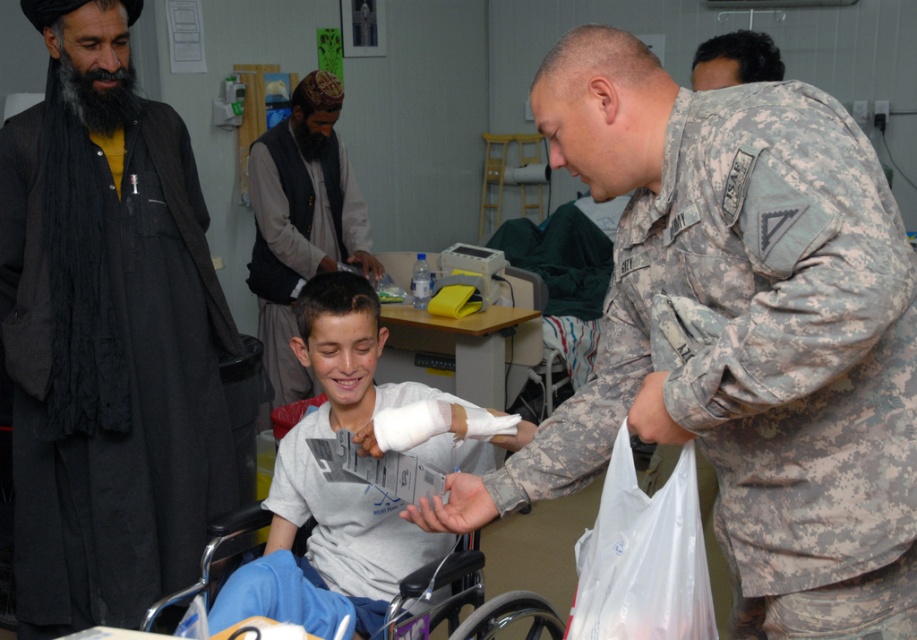
Question: Can you confirm if camouflage fabric uniform at right is wider than gray woolen vest at center?

Choices:
 (A) yes
 (B) no

Answer: (A)

Question: Which object is farther from the camera taking this photo?

Choices:
 (A) white matte bandage at center
 (B) camouflage fabric uniform at right
 (C) black matte robe at left
 (D) gray woolen vest at center

Answer: (D)

Question: Among these objects, which one is farthest from the camera?

Choices:
 (A) white matte bandage at center
 (B) gray woolen vest at center
 (C) black matte robe at left
 (D) camouflage fabric uniform at right

Answer: (B)

Question: Among these points, which one is nearest to the camera?

Choices:
 (A) (168, 372)
 (B) (319, 152)
 (C) (283, 525)
 (D) (635, 365)

Answer: (D)

Question: Is camouflage fabric uniform at right closer to the viewer compared to gray woolen vest at center?

Choices:
 (A) no
 (B) yes

Answer: (B)

Question: Is camouflage fabric uniform at right in front of black matte robe at left?

Choices:
 (A) no
 (B) yes

Answer: (B)